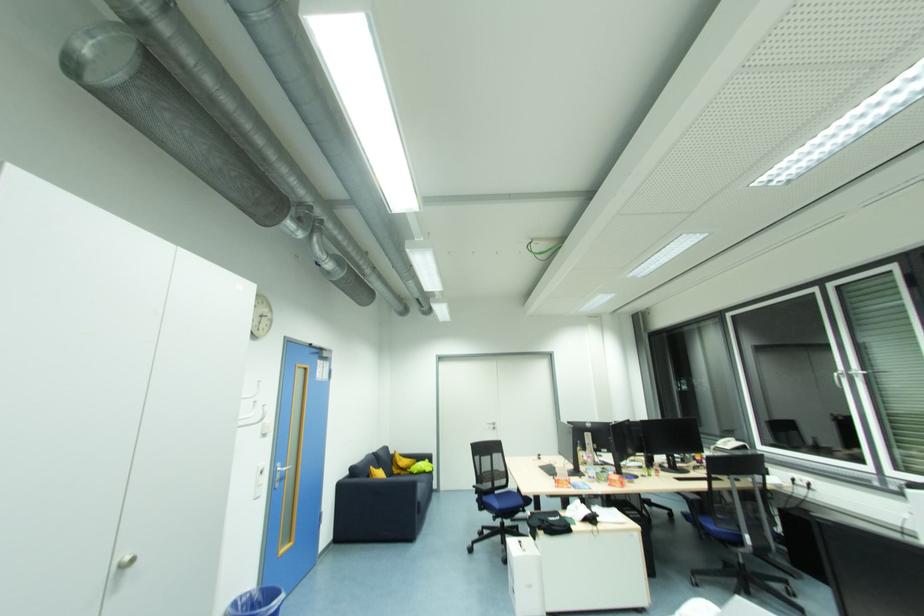
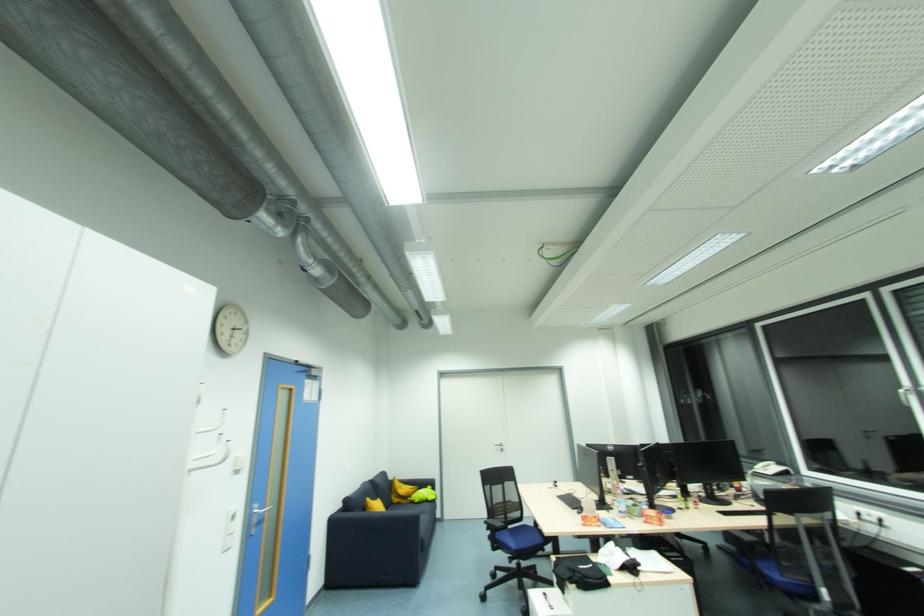
Find the pixel in the second image that matches point (402, 475) in the first image.

(400, 505)